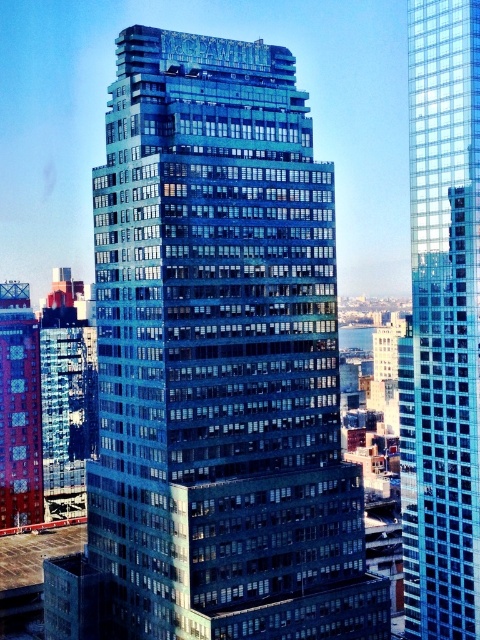
Can you confirm if shiny blue glass building at left is positioned below metallic red building at left?

No, shiny blue glass building at left is not below metallic red building at left.

Is shiny blue glass building at left positioned before metallic red building at left?

No, it is behind metallic red building at left.

Locate an element on the screen. The width and height of the screenshot is (480, 640). shiny blue glass building at left is located at coordinates (67, 394).

Does shiny glass building at center appear under metallic red building at left?

Incorrect, shiny glass building at center is not positioned below metallic red building at left.

Does shiny glass building at center have a lesser width compared to metallic red building at left?

In fact, shiny glass building at center might be wider than metallic red building at left.

Find the location of `shiny glass building at center`. shiny glass building at center is located at coordinates (219, 356).

The width and height of the screenshot is (480, 640). I want to click on shiny glass building at center, so click(219, 356).

Is glassy reflective skyscraper at center positioned in front of shiny blue glass building at left?

That is True.

Does point (419, 284) come farther from viewer compared to point (75, 422)?

No, (419, 284) is in front of (75, 422).

At what (x,y) coordinates should I click in order to perform the action: click on glassy reflective skyscraper at center. Please return your answer as a coordinate pair (x, y). The image size is (480, 640). Looking at the image, I should click on (442, 324).